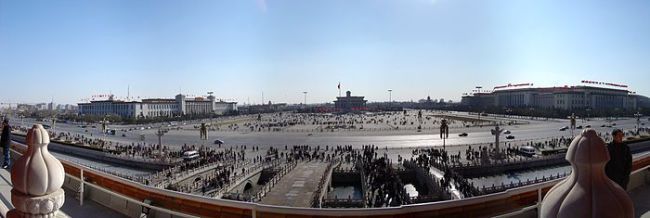
Locate an element on the screen. The width and height of the screenshot is (650, 218). light is located at coordinates (228, 78), (565, 53).